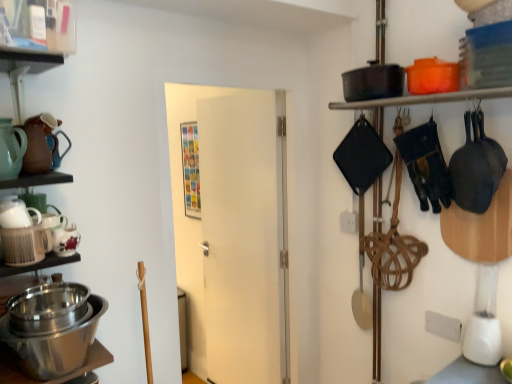
Question: Considering the relative positions of white matte door at center and ceramic tea pot at lower left, the 4th tea pot from the top, in the image provided, is white matte door at center to the left or to the right of ceramic tea pot at lower left, the 4th tea pot from the top,?

Choices:
 (A) left
 (B) right

Answer: (B)

Question: In terms of width, does white matte door at center look wider or thinner when compared to ceramic tea pot at lower left, marked as the first tea pot in a bottom-to-top arrangement?

Choices:
 (A) thin
 (B) wide

Answer: (B)

Question: Considering the real-world distances, which object is closest to the white plastic blender at right?

Choices:
 (A) clear plastic container at upper left, acting as the 1th shelf starting from the front
 (B) white matte door at center
 (C) matte ceramic teapot at left, arranged as the third tea pot when ordered from the bottom
 (D) matte brown teapot at upper left, which appears as the first tea pot when viewed from the top
 (E) matte black pot at upper right, which is counted as the 2th shelf, starting from the top

Answer: (E)

Question: Which is farther from the clear plastic container at upper left, which ranks as the 2th shelf in right-to-left order?

Choices:
 (A) white matte door at center
 (B) white plastic blender at right
 (C) stainless steel bowls at lower left
 (D) white matte tea pot at left, which ranks as the third tea pot in top-to-bottom order
 (E) matte ceramic teapot at left, arranged as the third tea pot when ordered from the bottom

Answer: (B)